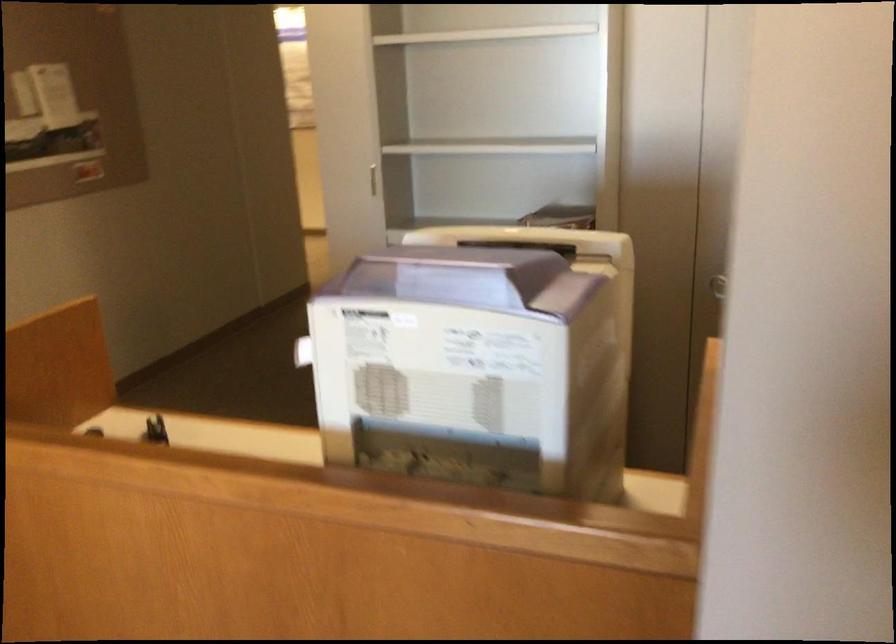
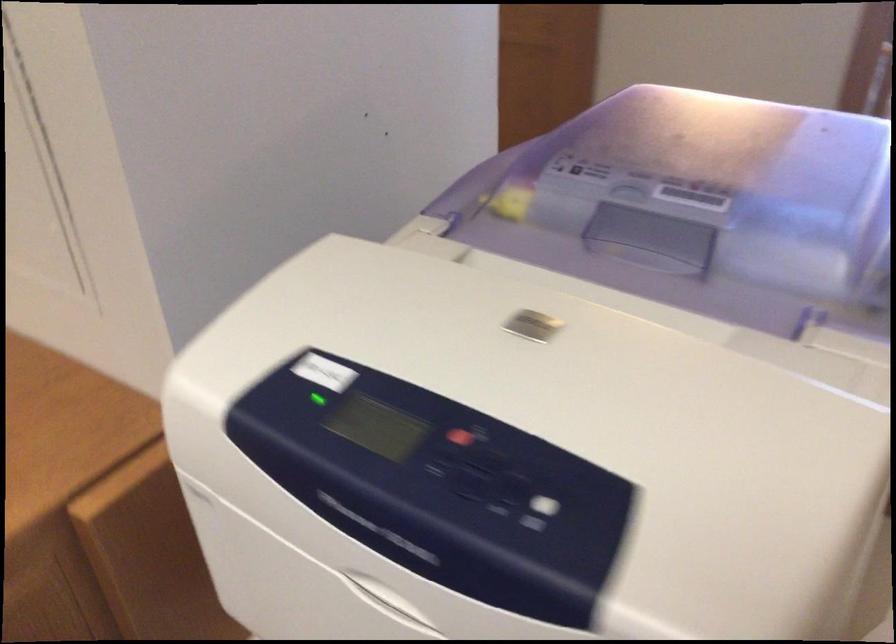
Where in the second image is the point corresponding to (467,278) from the first image?

(656, 234)